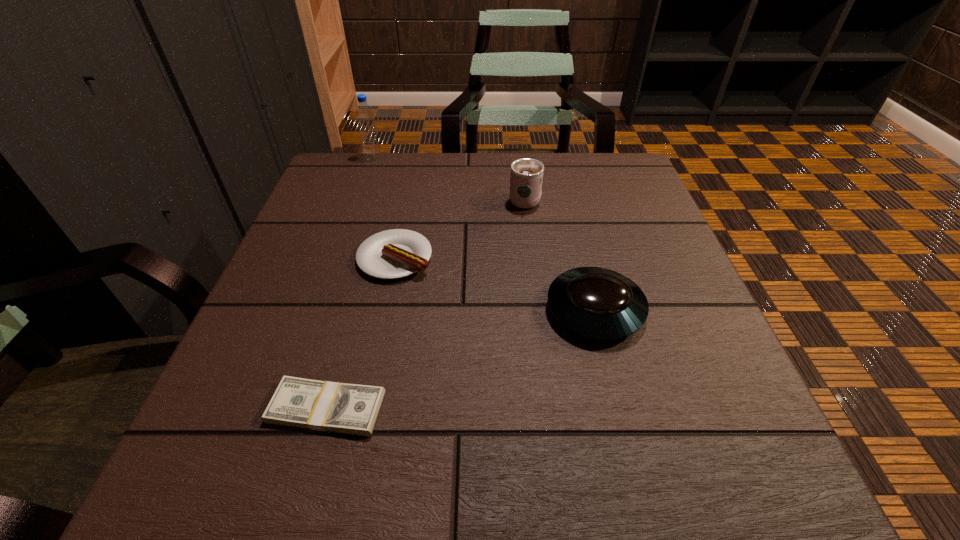
The height and width of the screenshot is (540, 960). Find the location of `vacant space positioned on the side with the handle of the cup`. vacant space positioned on the side with the handle of the cup is located at coordinates (520, 167).

Find the location of a particular element. This screenshot has height=540, width=960. free location located 0.260m on the back of the saucer is located at coordinates (567, 200).

The height and width of the screenshot is (540, 960). What are the coordinates of `free space located 0.080m on the right of the fourth tallest object` in the screenshot? It's located at (472, 258).

Find the location of a particular element. vacant space located 0.060m on the right of the dollar is located at coordinates [x=425, y=408].

I want to click on water bottle at the far edge, so click(x=364, y=114).

At what (x,y) coordinates should I click in order to perform the action: click on cup that is at the far edge. Please return your answer as a coordinate pair (x, y). Looking at the image, I should click on (526, 178).

You are a GUI agent. You are given a task and a screenshot of the screen. Output one action in this format:
    pyautogui.click(x=<x>, y=<y>)
    Task: Click on the object that is at the near edge
    The width and height of the screenshot is (960, 540).
    Given the screenshot: What is the action you would take?
    pyautogui.click(x=345, y=408)

Locate an element on the screen. This screenshot has height=540, width=960. water bottle that is positioned at the left edge is located at coordinates (364, 114).

What are the coordinates of `sausage present at the left edge` in the screenshot? It's located at (396, 253).

Image resolution: width=960 pixels, height=540 pixels. In order to click on dollar that is positioned at the left edge in this screenshot , I will do `click(345, 408)`.